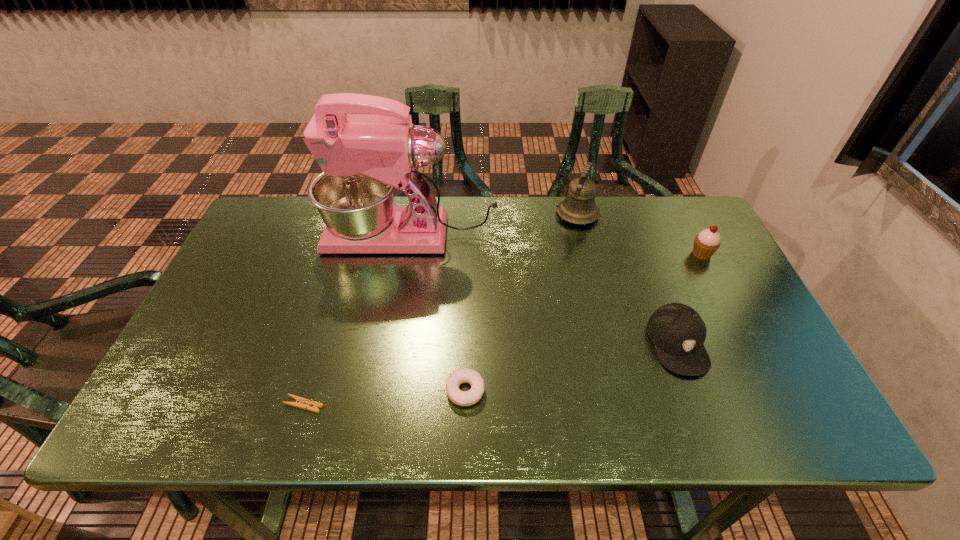
Find the location of a particular element. The width and height of the screenshot is (960, 540). vacant space positioned on the face of the mixer is located at coordinates (266, 235).

Identify the location of free space located 0.060m on the face of the mixer. This screenshot has width=960, height=540. (305, 235).

Image resolution: width=960 pixels, height=540 pixels. Find the location of `vacant space located on the left of the second tallest object`. vacant space located on the left of the second tallest object is located at coordinates (446, 214).

What are the coordinates of `vacant space located 0.080m on the left of the cupcake` in the screenshot? It's located at (662, 254).

The width and height of the screenshot is (960, 540). I want to click on free region located 0.130m on the front-facing side of the second object from right to left, so click(x=711, y=434).

The width and height of the screenshot is (960, 540). Identify the location of vacant space located 0.400m on the left of the second shortest object. (265, 391).

Identify the location of blank space located on the back of the shortest object. The image size is (960, 540). (328, 323).

At what (x,y) coordinates should I click in order to perform the action: click on mixer that is at the far edge. Please return your answer as a coordinate pair (x, y). Looking at the image, I should click on (364, 157).

Locate an element on the screen. The width and height of the screenshot is (960, 540). bell that is positioned at the far edge is located at coordinates 579,207.

You are a GUI agent. You are given a task and a screenshot of the screen. Output one action in this format:
    pyautogui.click(x=<x>, y=<y>)
    Task: Click on the doughnut that is at the near edge
    
    Given the screenshot: What is the action you would take?
    pyautogui.click(x=462, y=398)